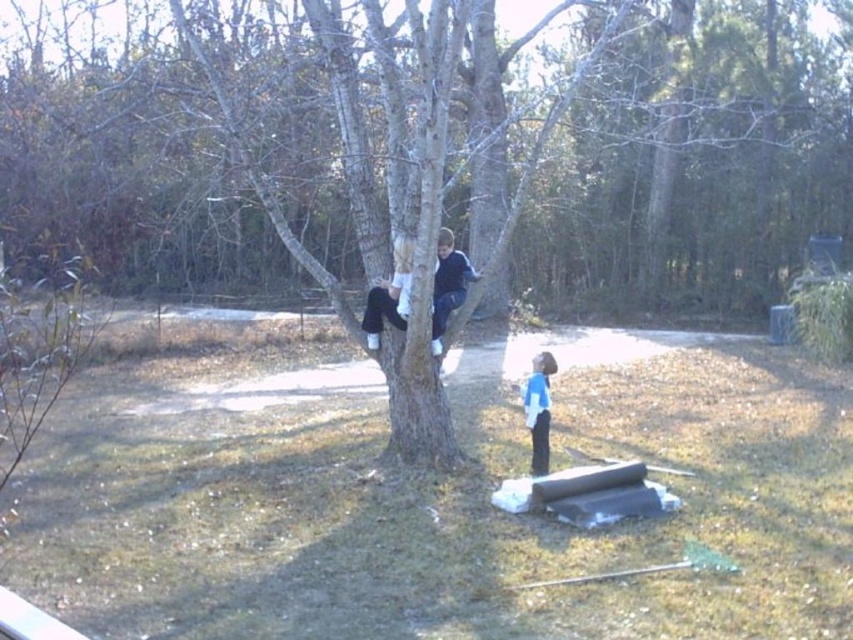
Question: Is blue fleece jacket at tree bigger than blue cotton shirt at lower center?

Choices:
 (A) no
 (B) yes

Answer: (B)

Question: Which object is closer to the camera taking this photo?

Choices:
 (A) brown grass at lower center
 (B) brown rough tree at center
 (C) blue fleece jacket at tree

Answer: (A)

Question: Does brown grass at lower center come behind brown rough tree at center?

Choices:
 (A) yes
 (B) no

Answer: (B)

Question: Which object appears farthest from the camera in this image?

Choices:
 (A) brown grass at lower center
 (B) brown rough tree at center
 (C) blue cotton shirt at lower center
 (D) blue fleece jacket at tree

Answer: (C)

Question: Is brown rough tree at center wider than blue cotton shirt at lower center?

Choices:
 (A) yes
 (B) no

Answer: (A)

Question: Among these points, which one is farthest from the camera?

Choices:
 (A) (x=456, y=259)
 (B) (x=672, y=298)
 (C) (x=584, y=344)
 (D) (x=527, y=426)

Answer: (B)